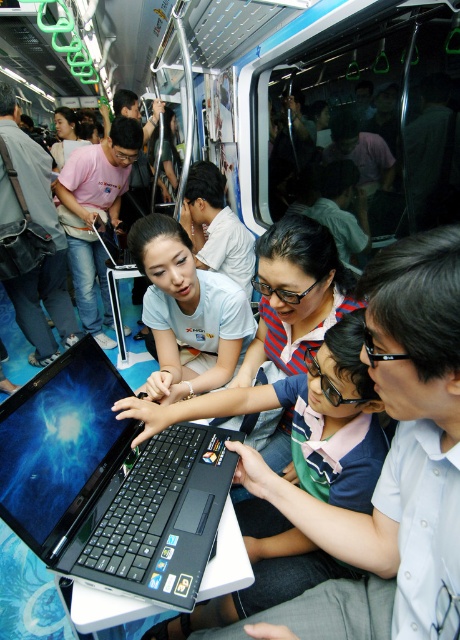
Question: Can you confirm if matte pink shirt at center is positioned to the right of light blue shirt at center?

Choices:
 (A) yes
 (B) no

Answer: (B)

Question: Is matte white shirt at center below light blue shirt at center?

Choices:
 (A) yes
 (B) no

Answer: (A)

Question: Estimate the real-world distances between objects in this image. Which object is farther from the light blue shirt at center?

Choices:
 (A) matte black laptop at left
 (B) matte white shirt at center
 (C) black plastic laptop at center

Answer: (C)

Question: Which is nearer to the black plastic laptop at center?

Choices:
 (A) matte white shirt at center
 (B) light blue shirt at center

Answer: (A)

Question: Among these points, which one is farthest from the camera?

Choices:
 (A) (160, 301)
 (B) (243, 230)

Answer: (B)

Question: Is matte pink shirt at center above matte black laptop at left?

Choices:
 (A) yes
 (B) no

Answer: (A)